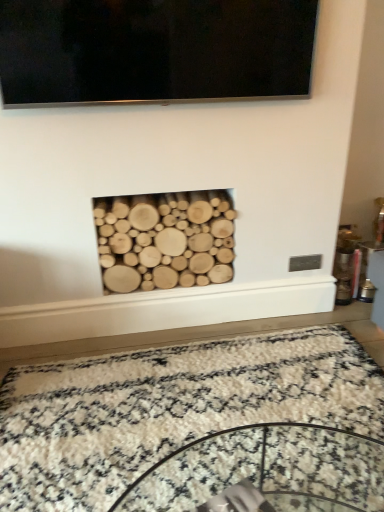
The width and height of the screenshot is (384, 512). Identify the location of free point above white shaggy rug at center (from a real-world perspective). (187, 403).